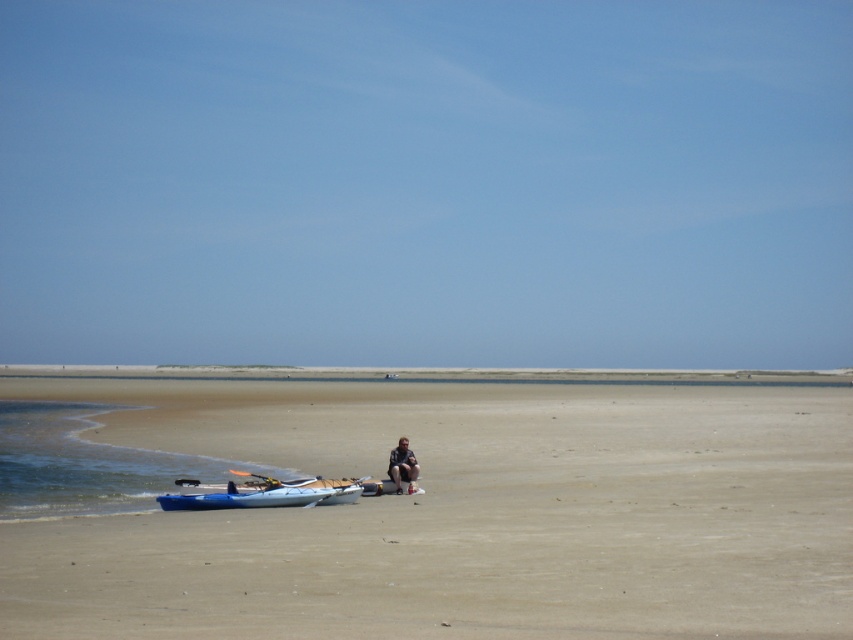
You are a photographer trying to capture the blue plastic kayak at lower left and the beige sand at center in a single shot. Based on the scene, can you position yourself so that both objects are visible in the frame without moving either object?

The beige sand at center is below the blue plastic kayak at lower left, so positioning yourself at a higher angle or moving back slightly would allow both the blue plastic kayak at lower left and the beige sand at center to be visible in the frame.

You are standing at the shoreline on the beach and see two points marked on the sand. The first point is at coordinate point(204,506) and the second is at point(390,470). If you want to reach the point that is closer to the horizon, which coordinate should you head towards?

Point(390,470) is further away from you than point(204,506), so to reach the point closer to the horizon, you should head towards point(390,470).